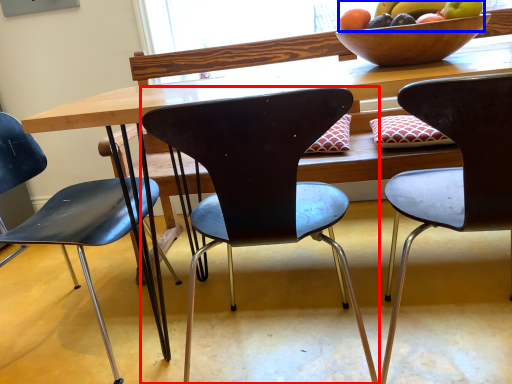
Question: Which of the following is the closest to the observer, chair (highlighted by a red box) or grapefruit (highlighted by a blue box)?

Choices:
 (A) chair
 (B) grapefruit

Answer: (A)